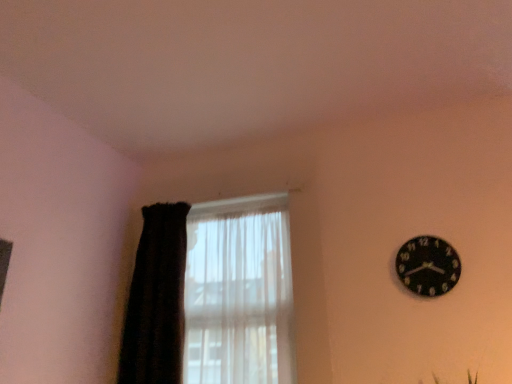
Question: Considering their positions, is translucent fabric at left located in front of or behind black fuzzy curtain at left?

Choices:
 (A) front
 (B) behind

Answer: (A)

Question: In terms of size, does translucent fabric at left appear bigger or smaller than black fuzzy curtain at left?

Choices:
 (A) big
 (B) small

Answer: (A)

Question: Which is nearer to the translucent fabric at left?

Choices:
 (A) black matte clock at upper right
 (B) black fuzzy curtain at left

Answer: (B)

Question: Considering the real-world distances, which object is closest to the black matte clock at upper right?

Choices:
 (A) black fuzzy curtain at left
 (B) translucent fabric at left

Answer: (B)